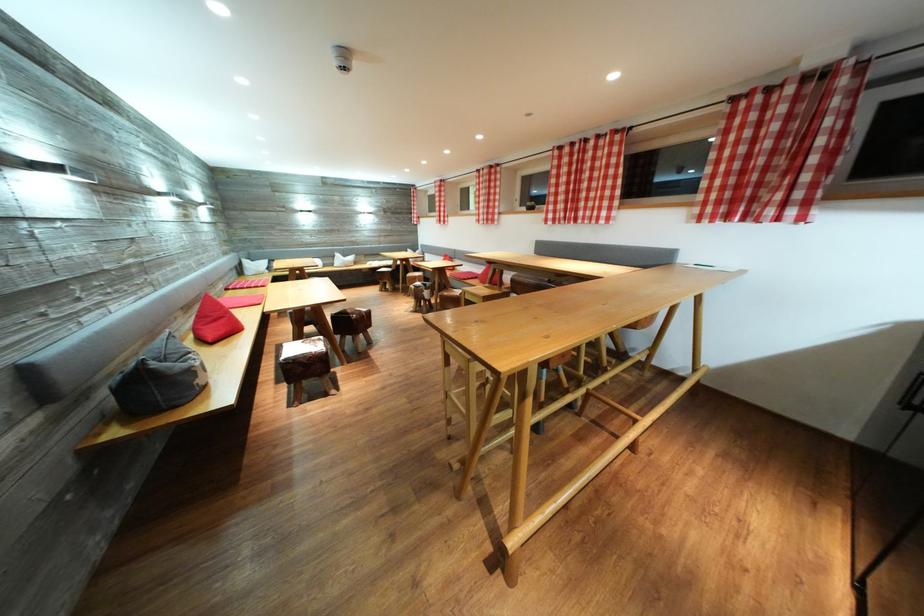
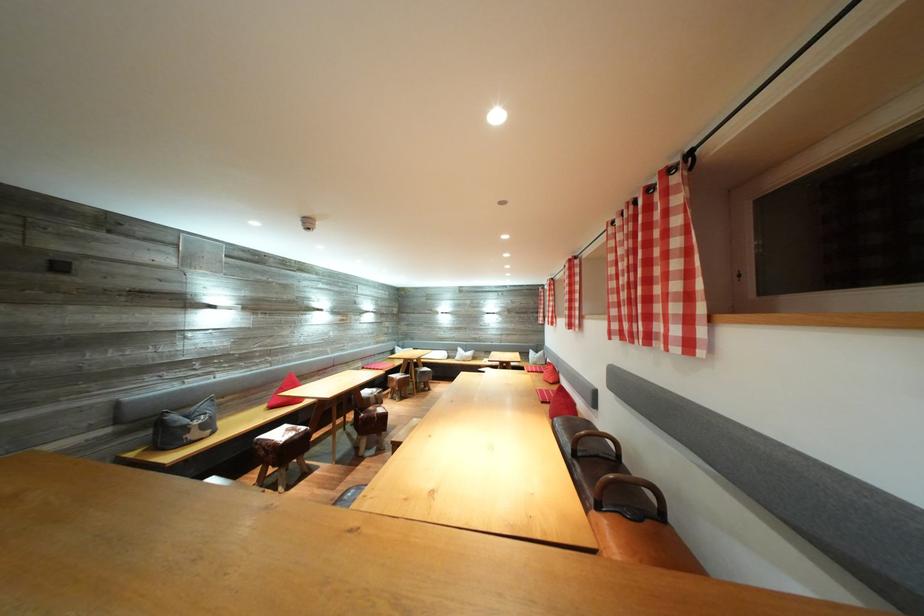
Question: I am providing you with two images of the same scene from different viewpoints. After the viewpoint changes to image2, which objects are now occluded?

Choices:
 (A) water bottle with strap
 (B) wooden stool
 (C) sofa sitting surface
 (D) red seat cushion

Answer: (B)